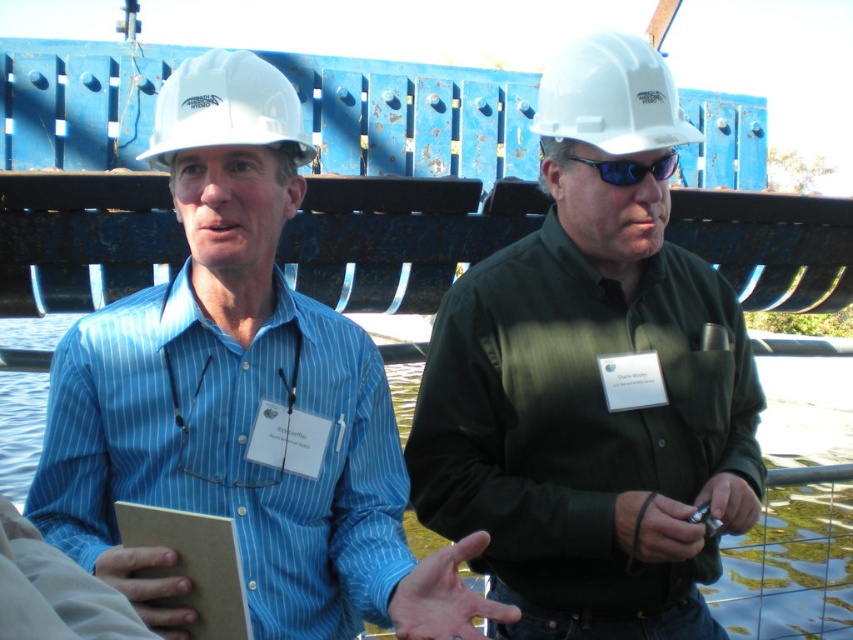
Between blue striped shirt at left and white hard hat at upper center, which one has less height?

With less height is white hard hat at upper center.

You are a GUI agent. You are given a task and a screenshot of the screen. Output one action in this format:
    pyautogui.click(x=<x>, y=<y>)
    Task: Click on the blue striped shirt at left
    The image size is (853, 640).
    Given the screenshot: What is the action you would take?
    pyautogui.click(x=233, y=449)

Which of these two, white hard hat at upper center or white hard hat at upper left, stands shorter?

white hard hat at upper left is shorter.

Does white hard hat at upper center appear on the left side of white hard hat at upper left?

No, white hard hat at upper center is not to the left of white hard hat at upper left.

Image resolution: width=853 pixels, height=640 pixels. What do you see at coordinates (610, 97) in the screenshot?
I see `white hard hat at upper center` at bounding box center [610, 97].

Identify the location of white hard hat at upper center. (610, 97).

Is white hard hat at upper center wider than sunglasses at center?

Yes, white hard hat at upper center is wider than sunglasses at center.

I want to click on white hard hat at upper center, so click(610, 97).